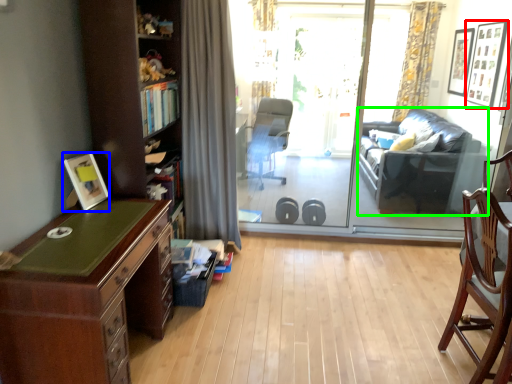
Question: Considering the real-world distances, which object is farthest from picture frame (highlighted by a red box)? picture frame (highlighted by a blue box) or studio couch (highlighted by a green box)?

Choices:
 (A) picture frame
 (B) studio couch

Answer: (A)